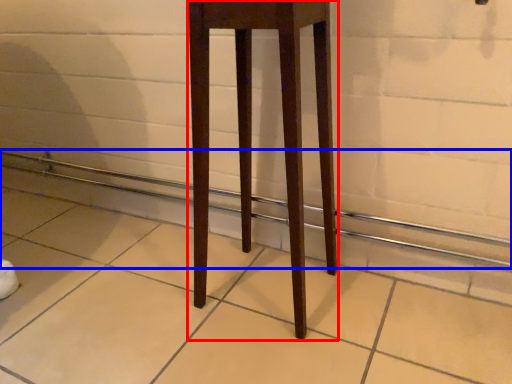
Question: Which object appears farthest to the camera in this image, furniture (highlighted by a red box) or balustrade (highlighted by a blue box)?

Choices:
 (A) furniture
 (B) balustrade

Answer: (B)